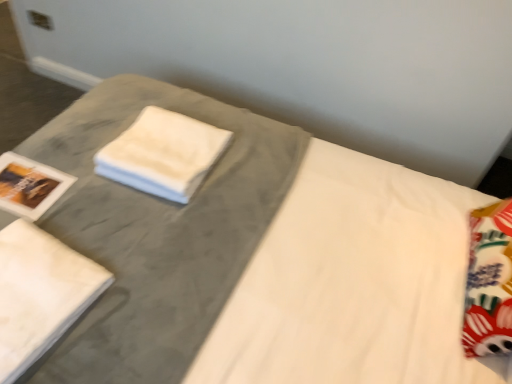
Question: Is white soft cloth at center at the back of white cotton bath towel at lower left?

Choices:
 (A) yes
 (B) no

Answer: (B)

Question: Would you say white cotton bath towel at lower left is outside white soft cloth at center?

Choices:
 (A) no
 (B) yes

Answer: (B)

Question: Considering the relative sizes of white cotton bath towel at lower left and white soft cloth at center in the image provided, is white cotton bath towel at lower left smaller than white soft cloth at center?

Choices:
 (A) no
 (B) yes

Answer: (B)

Question: Does white cotton bath towel at lower left appear on the left side of white soft cloth at center?

Choices:
 (A) yes
 (B) no

Answer: (A)

Question: Is white cotton bath towel at lower left far from white soft cloth at center?

Choices:
 (A) no
 (B) yes

Answer: (A)

Question: Is white cotton bath towel at lower left surrounding white soft cloth at center?

Choices:
 (A) yes
 (B) no

Answer: (B)

Question: Is white soft cloth at center looking in the opposite direction of white cotton bath towel at lower left?

Choices:
 (A) no
 (B) yes

Answer: (A)

Question: Is white soft cloth at center at the right side of white cotton bath towel at lower left?

Choices:
 (A) yes
 (B) no

Answer: (A)

Question: Is white soft cloth at center positioned beyond the bounds of white cotton bath towel at lower left?

Choices:
 (A) no
 (B) yes

Answer: (B)

Question: From the image's perspective, is white soft cloth at center over white cotton bath towel at lower left?

Choices:
 (A) no
 (B) yes

Answer: (B)

Question: Does white soft cloth at center have a smaller size compared to white cotton bath towel at lower left?

Choices:
 (A) yes
 (B) no

Answer: (B)

Question: Is there a large distance between white soft cloth at center and white cotton bath towel at lower left?

Choices:
 (A) no
 (B) yes

Answer: (A)

Question: Based on their positions, is white soft cloth at center located to the left or right of white cotton bath towel at lower left?

Choices:
 (A) right
 (B) left

Answer: (A)